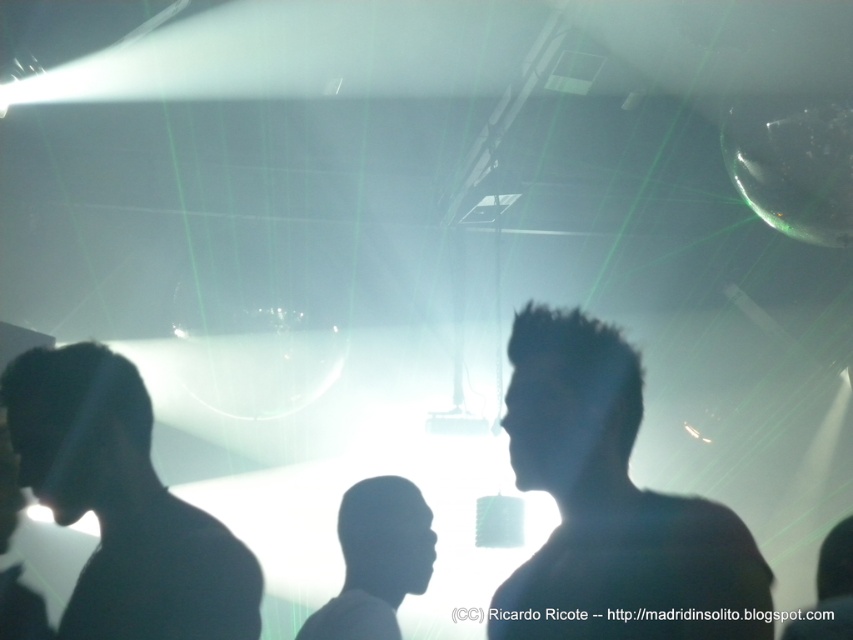
Which is more to the left, silhouette hair at center or dark matte head at center?

dark matte head at center is more to the left.

Describe the element at coordinates (610, 506) in the screenshot. I see `silhouette hair at center` at that location.

You are a GUI agent. You are given a task and a screenshot of the screen. Output one action in this format:
    pyautogui.click(x=<x>, y=<y>)
    Task: Click on the silhouette hair at center
    This screenshot has width=853, height=640.
    Given the screenshot: What is the action you would take?
    tap(610, 506)

Is point (187, 616) more distant than point (383, 490)?

No, it is not.

Where is `black matte head at left`? This screenshot has width=853, height=640. black matte head at left is located at coordinates click(123, 504).

Locate an element on the screen. The image size is (853, 640). black matte head at left is located at coordinates (123, 504).

Who is more distant from viewer, (647, 618) or (119, 545)?

The point (119, 545) is behind.

Consider the image. Is silhouette hair at center shorter than black matte head at left?

No, silhouette hair at center is not shorter than black matte head at left.

Does point (683, 624) lie behind point (96, 605)?

That is False.

In order to click on silhouette hair at center in this screenshot , I will do `click(610, 506)`.